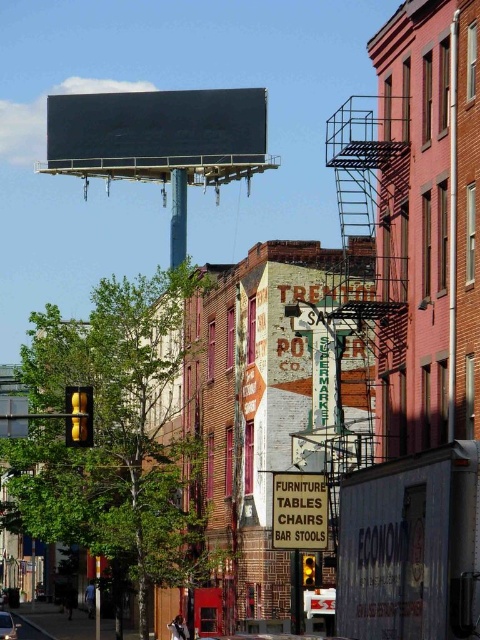
Does white cardboard sign at center have a lesser width compared to shiny silver car at center?

Yes, white cardboard sign at center is thinner than shiny silver car at center.

Can you confirm if white cardboard sign at center is positioned to the right of shiny silver car at center?

Indeed, white cardboard sign at center is positioned on the right side of shiny silver car at center.

Who is more distant from viewer, [312,531] or [10,632]?

Positioned behind is point [10,632].

Identify the location of white cardboard sign at center. (300, 512).

Who is taller, white cardboard sign at center or yellow matte traffic light at lower left?

white cardboard sign at center

Consider the image. Does white cardboard sign at center have a lesser width compared to yellow matte traffic light at lower left?

In fact, white cardboard sign at center might be wider than yellow matte traffic light at lower left.

Which is in front, point (297, 483) or point (82, 417)?

Positioned in front is point (297, 483).

Where is `white cardboard sign at center`? The height and width of the screenshot is (640, 480). white cardboard sign at center is located at coordinates (300, 512).

Who is more forward, (74, 388) or (4, 612)?

Point (74, 388) is in front.

This screenshot has height=640, width=480. Find the location of `yellow matte traffic light at lower left`. yellow matte traffic light at lower left is located at coordinates (79, 417).